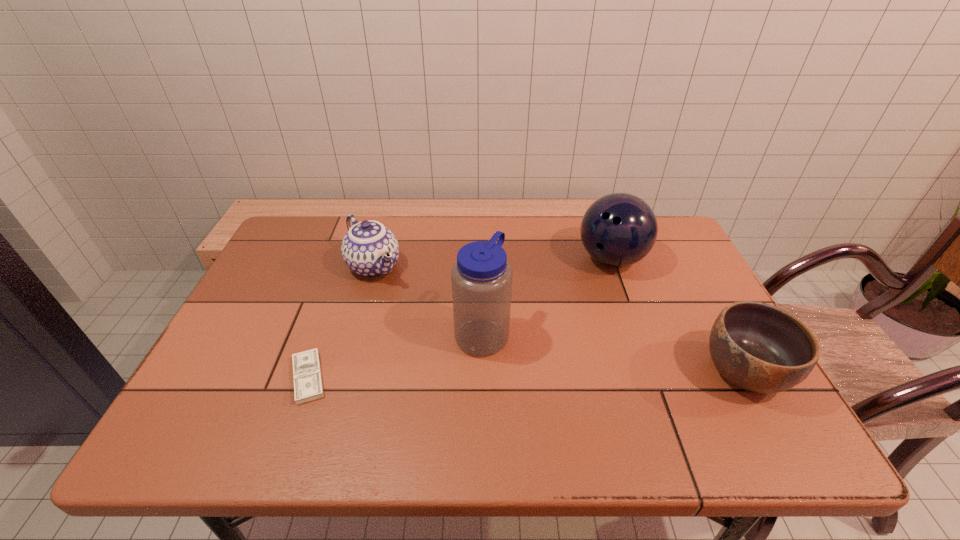
The height and width of the screenshot is (540, 960). Identify the location of money present at the near edge. (307, 376).

The image size is (960, 540). I want to click on bowl situated at the near edge, so click(x=757, y=347).

At what (x,y) coordinates should I click in order to perform the action: click on bowl at the right edge. Please return your answer as a coordinate pair (x, y). This screenshot has width=960, height=540. Looking at the image, I should click on (757, 347).

Locate an element on the screen. The height and width of the screenshot is (540, 960). bowling ball that is at the right edge is located at coordinates (619, 229).

The width and height of the screenshot is (960, 540). Find the location of `object that is at the far right corner`. object that is at the far right corner is located at coordinates (619, 229).

Find the location of a particular element. This screenshot has height=540, width=960. object situated at the near right corner is located at coordinates point(757,347).

You are a GUI agent. You are given a task and a screenshot of the screen. Output one action in this format:
    pyautogui.click(x=<x>, y=<y>)
    Task: Click on the free space at the far edge
    The image size is (960, 540).
    Given the screenshot: What is the action you would take?
    pyautogui.click(x=542, y=242)

Locate an element on the screen. free space at the near edge is located at coordinates (643, 395).

I want to click on vacant space at the left edge, so click(x=265, y=282).

The height and width of the screenshot is (540, 960). In the image, there is a desktop. What are the coordinates of `vacant area at the right edge` in the screenshot? It's located at (649, 266).